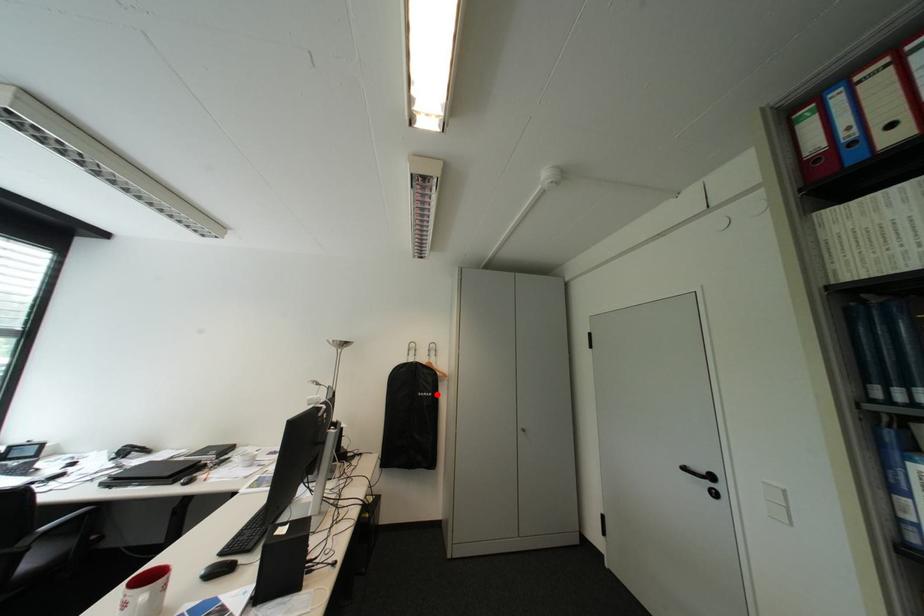
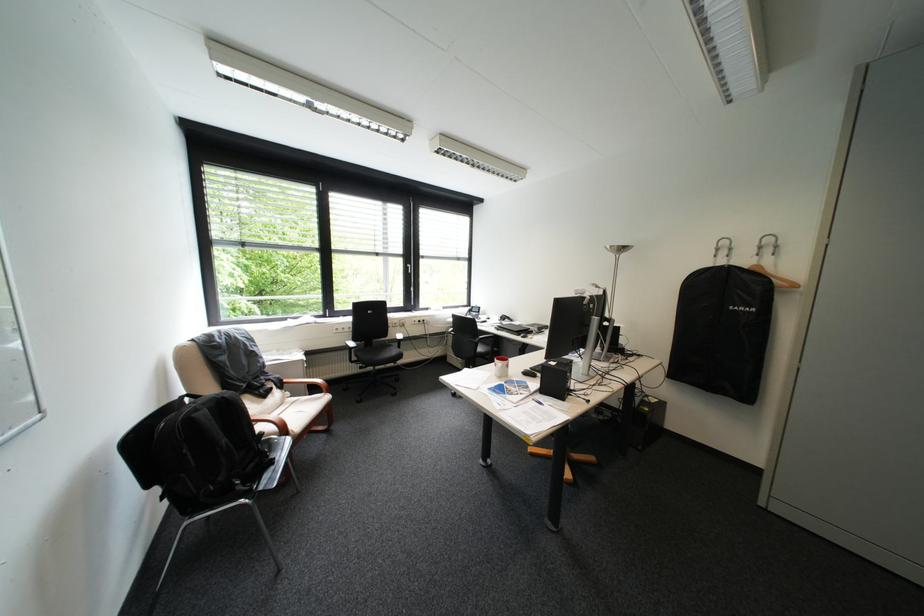
Question: A red point is marked in image1. In image2, is the corresponding 3D point closer to the camera or farther? Reply with the corresponding letter.

Choices:
 (A) The corresponding 3D point is closer.
 (B) The corresponding 3D point is farther.

Answer: (A)